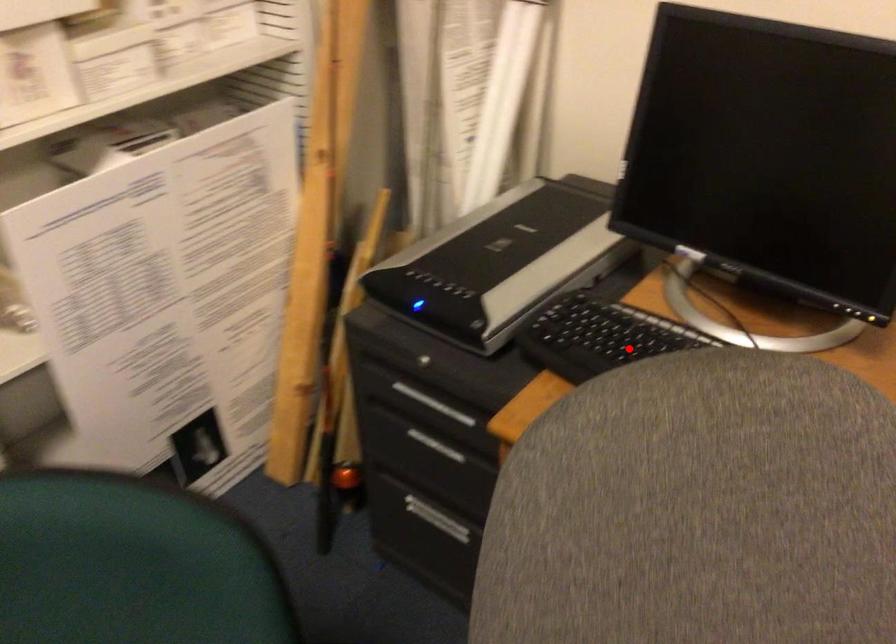
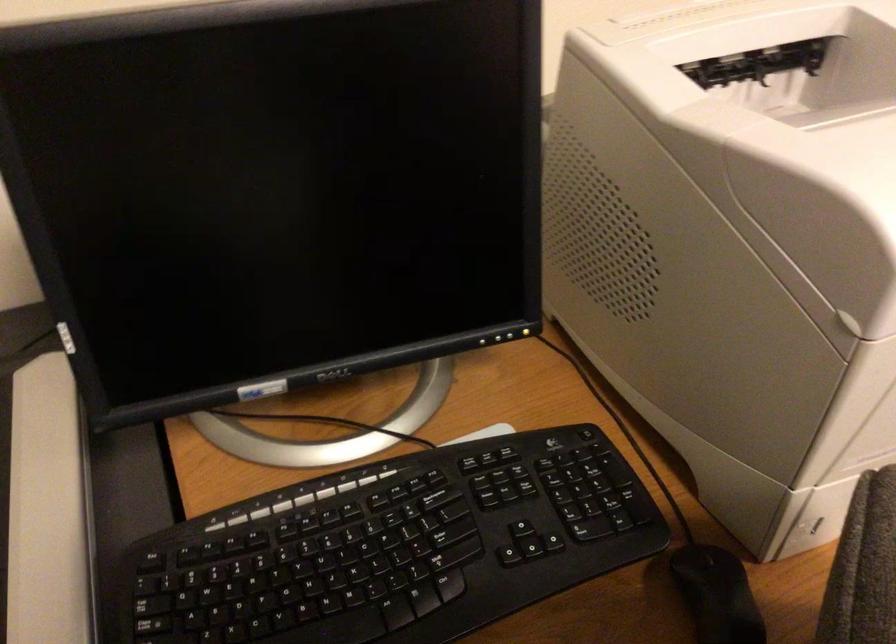
Question: A red point is marked in image1. In image2, is the corresponding 3D point closer to the camera or farther? Reply with the corresponding letter.

Choices:
 (A) The corresponding 3D point is closer.
 (B) The corresponding 3D point is farther.

Answer: (A)